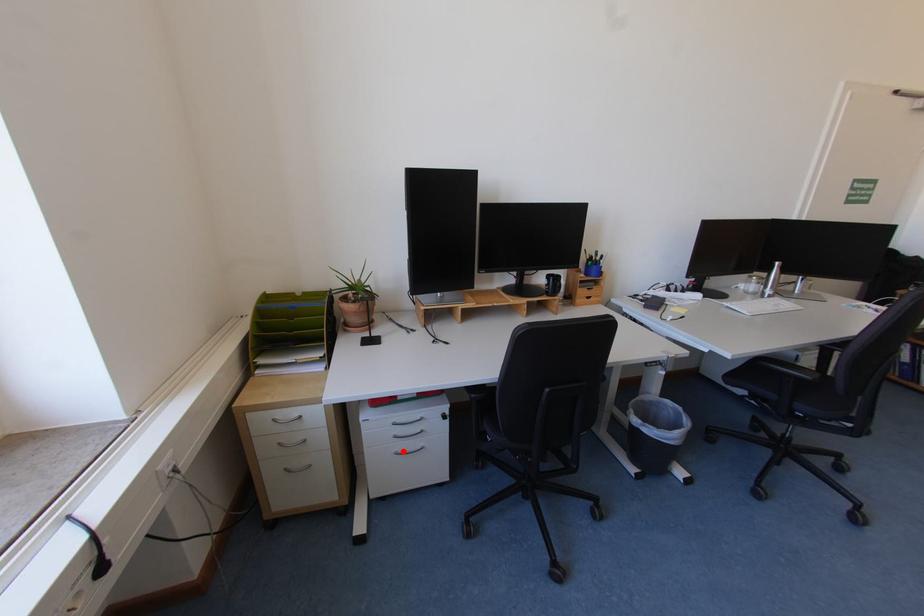
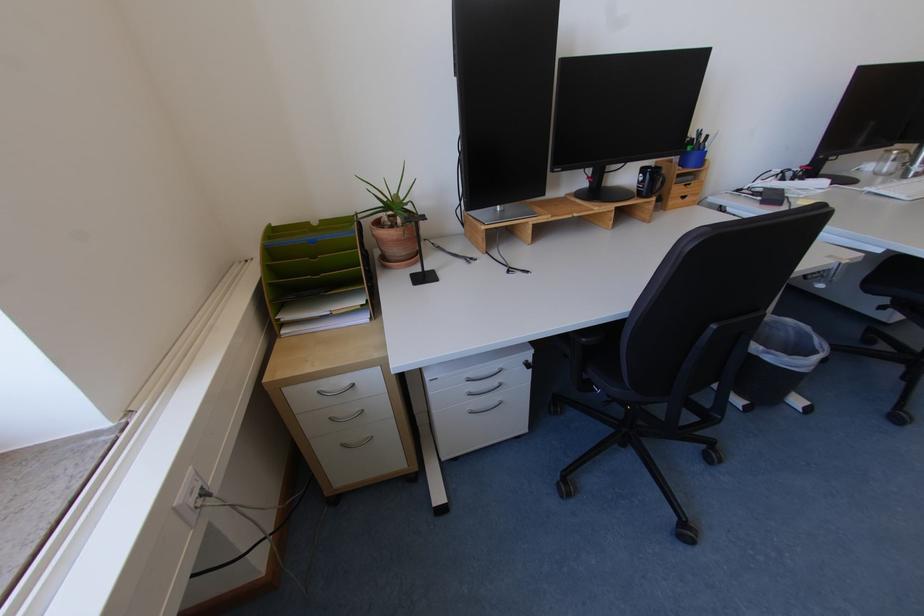
Question: I am providing you with two images of the same scene from different viewpoints. In image1, a red point is highlighted. Considering the same 3D point in image2, which of the following is correct?

Choices:
 (A) It is closer
 (B) It is farther

Answer: (A)